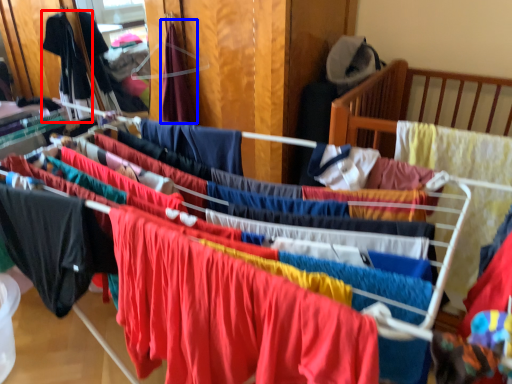
Question: Which object appears farthest to the camera in this image, clothing (highlighted by a red box) or clothing (highlighted by a blue box)?

Choices:
 (A) clothing
 (B) clothing

Answer: (A)